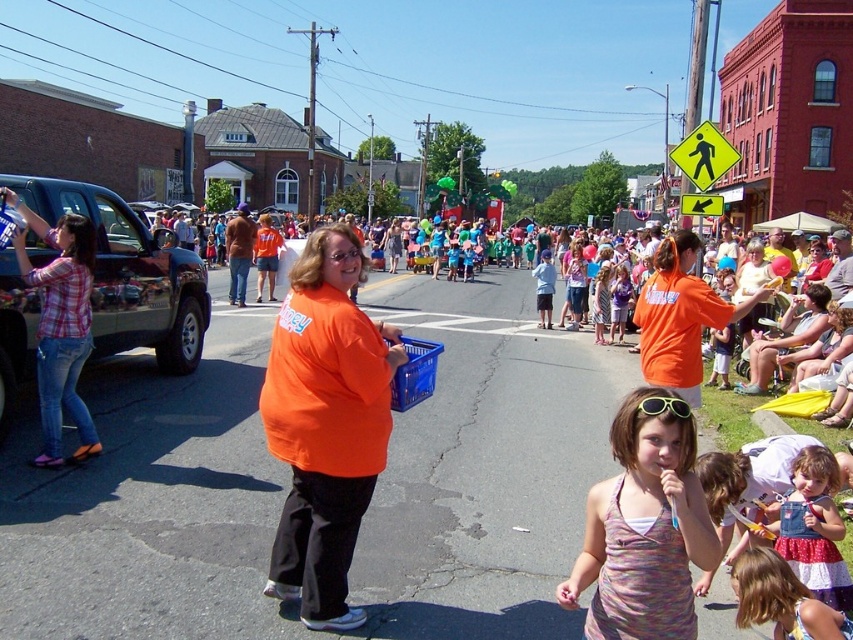
You are standing at the center of the street and want to locate the orange fabric shirt at center. According to the coordinates provided, in which direction should you look relative to your position?

The orange fabric shirt at center is located at coordinates point (325, 424). Since the coordinates are given as x,y values between 0 and 1, with (0, 0) being the bottom left corner of the image, the shirt is positioned to the right and slightly above the center point.

You are a photographer trying to capture the printed cotton tank top at center and the denim dress at lower right in a single frame. Based on their positions, can you tell which one is closer to the camera?

The printed cotton tank top at center is positioned over the denim dress at lower right, so it is closer to the camera.